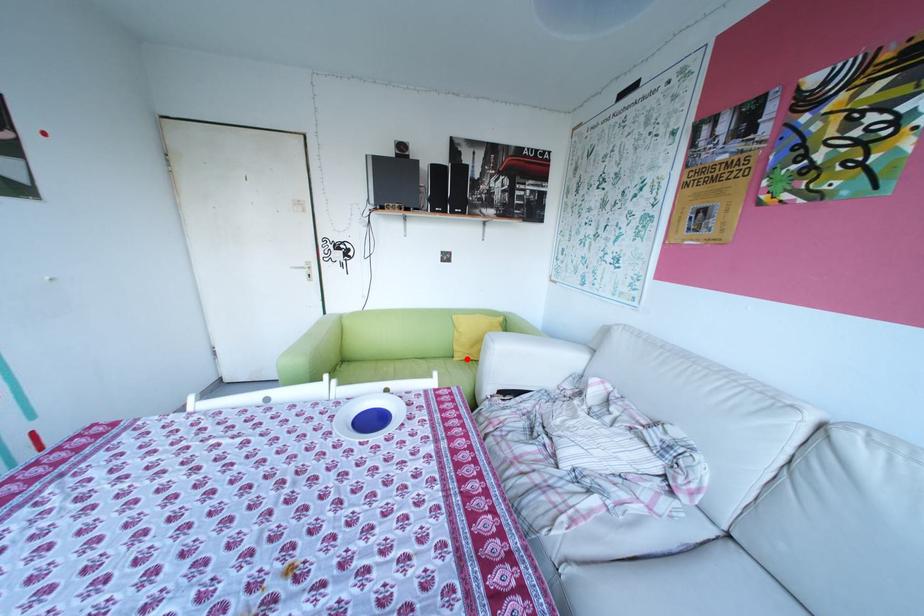
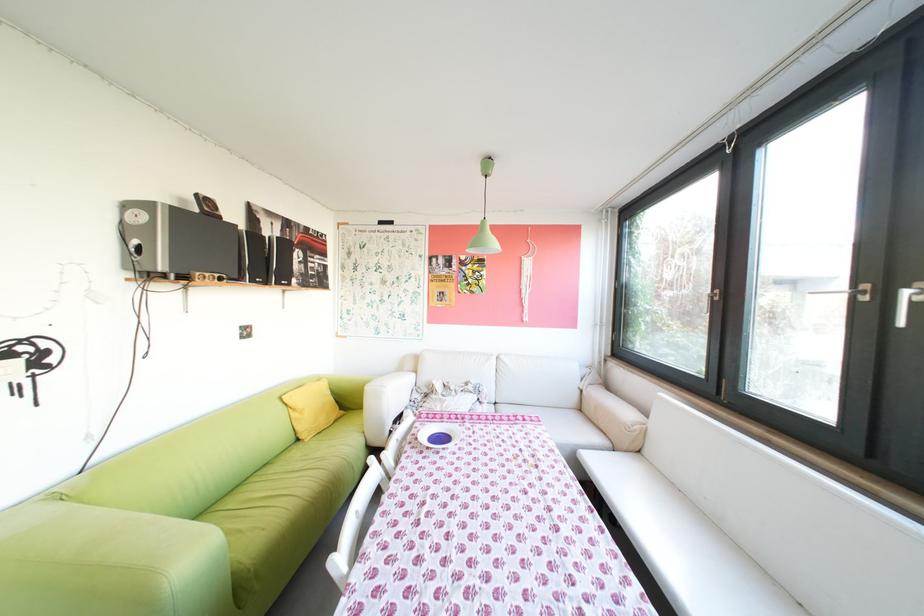
Question: I am providing you with two images of the same scene from different viewpoints. A red point is marked on the first image. Can you still see the location of the red point in image 2?

Choices:
 (A) Yes
 (B) No

Answer: (A)